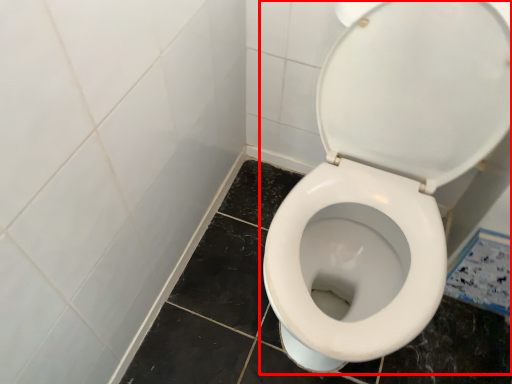
Question: From the image's perspective, what is the correct spatial relationship of toilet (annotated by the red box) in relation to ceramic tile?

Choices:
 (A) above
 (B) below

Answer: (A)